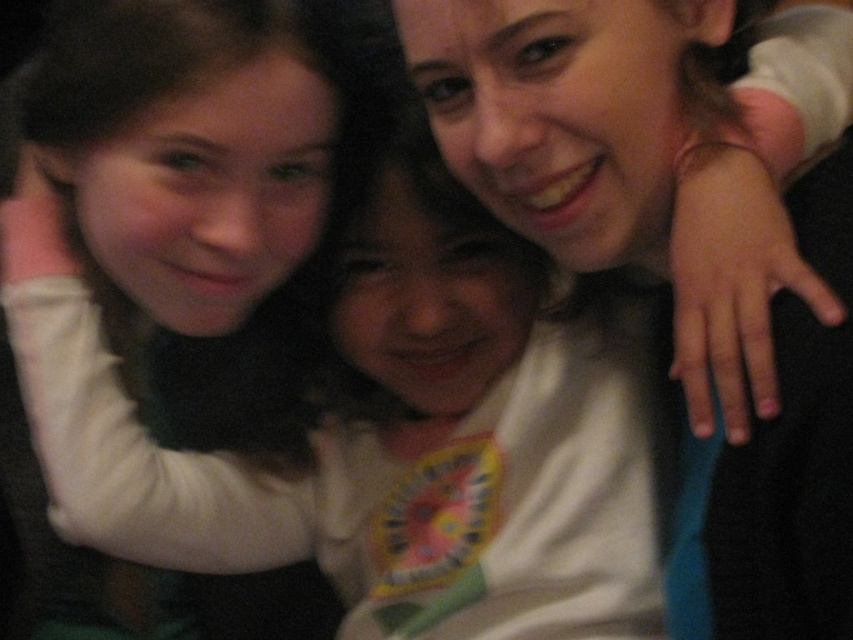
Question: Does white soft shirt at center lie in front of matte white shirt at upper right?

Choices:
 (A) yes
 (B) no

Answer: (B)

Question: Which object is closer to the camera taking this photo?

Choices:
 (A) matte white shirt at upper right
 (B) white soft shirt at center

Answer: (A)

Question: Which of the following is the farthest from the observer?

Choices:
 (A) white soft shirt at center
 (B) matte white shirt at upper right

Answer: (A)

Question: Is white soft shirt at center to the left of matte white shirt at upper right from the viewer's perspective?

Choices:
 (A) yes
 (B) no

Answer: (A)

Question: Does white soft shirt at center lie in front of matte white shirt at upper right?

Choices:
 (A) no
 (B) yes

Answer: (A)